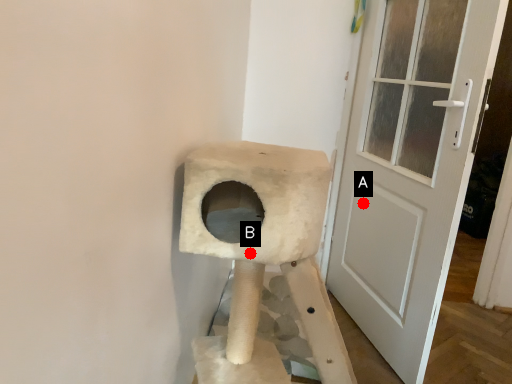
Question: Two points are circled on the image, labeled by A and B beside each circle. Which point is farther to the camera?

Choices:
 (A) A is further
 (B) B is further

Answer: (A)